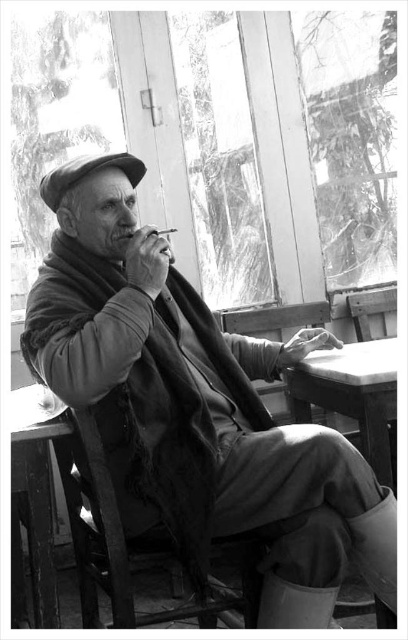
Based on the scene described, which object, the transparent glass window at upper center or the smooth wooden table at lower center, occupies a greater area in the image?

The transparent glass window at upper center is larger in size than the smooth wooden table at lower center, so it occupies a greater area in the image.

Based on the scene description, what object is located at the coordinates point (350, 138)?

The point (350, 138) corresponds to the transparent glass window at upper center.

You are standing at the origin point in the image. Which direction should you move to reach the wooden chair at lower left?

The wooden chair at lower left is located at point 0.853 on the x axis and 0.336 on the y axis. Since the origin is at the bottom left corner, moving towards higher x values would be to the right and higher y values upwards. To reach the wooden chair at lower left, you should move to the right and slightly upwards from the origin.